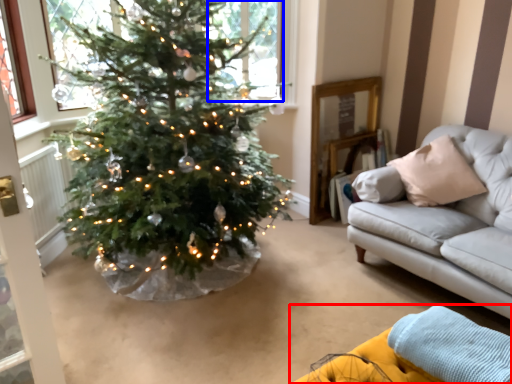
Question: Which object is closer to the camera taking this photo, couch (highlighted by a red box) or window (highlighted by a blue box)?

Choices:
 (A) couch
 (B) window

Answer: (A)